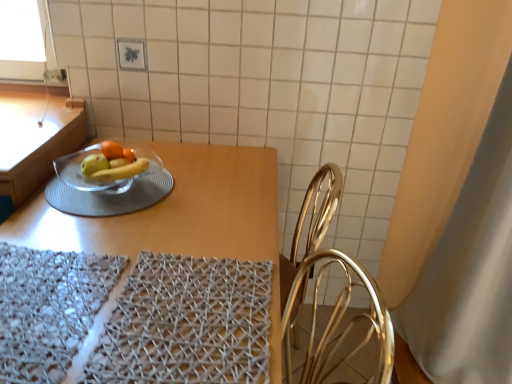
Question: Would you say transparent glass bowl at center is inside or outside woven fabric place mat at lower left, which is the first place mat from left to right?

Choices:
 (A) inside
 (B) outside

Answer: (B)

Question: Considering the positions of transparent glass bowl at center and woven fabric place mat at lower left, which is the first place mat from left to right, in the image, is transparent glass bowl at center wider or thinner than woven fabric place mat at lower left, which is the first place mat from left to right,?

Choices:
 (A) thin
 (B) wide

Answer: (B)

Question: Considering the real-world distances, which object is closest to the woven fabric place mat at lower left, which is the first place mat from left to right?

Choices:
 (A) white fabric curtain at right
 (B) wooden table at center
 (C) woven fabric place mat at lower center, the 1th place mat when ordered from right to left
 (D) transparent glass bowl at center

Answer: (C)

Question: Based on their relative distances, which object is farther from the woven fabric place mat at lower left, which is the second place mat in right-to-left order?

Choices:
 (A) transparent glass bowl at center
 (B) white fabric curtain at right
 (C) wooden table at center
 (D) woven fabric place mat at lower center, the 1th place mat when ordered from right to left

Answer: (B)